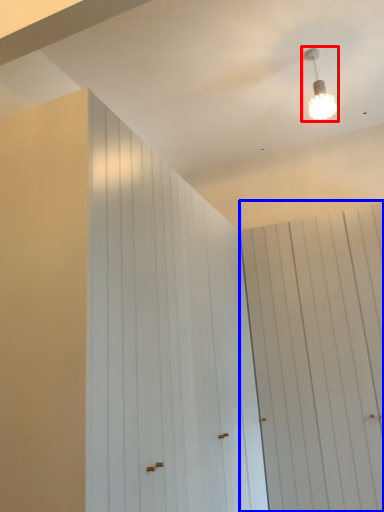
Question: Which object appears closest to the camera in this image, lamp (highlighted by a red box) or barn door (highlighted by a blue box)?

Choices:
 (A) lamp
 (B) barn door

Answer: (B)